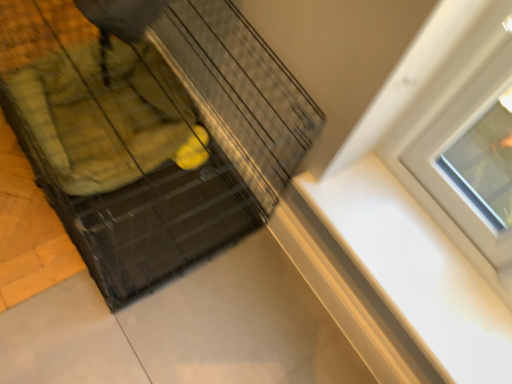
Question: From a real-world perspective, is white glossy window sill at upper right physically above black wire baby carriage at center?

Choices:
 (A) no
 (B) yes

Answer: (B)

Question: Is white glossy window sill at upper right turned away from black wire baby carriage at center?

Choices:
 (A) yes
 (B) no

Answer: (B)

Question: From the image's perspective, is white glossy window sill at upper right under black wire baby carriage at center?

Choices:
 (A) no
 (B) yes

Answer: (B)

Question: Considering the relative sizes of white glossy window sill at upper right and black wire baby carriage at center in the image provided, is white glossy window sill at upper right smaller than black wire baby carriage at center?

Choices:
 (A) yes
 (B) no

Answer: (A)

Question: Is white glossy window sill at upper right not within black wire baby carriage at center?

Choices:
 (A) no
 (B) yes

Answer: (B)

Question: Considering the relative sizes of white glossy window sill at upper right and black wire baby carriage at center in the image provided, is white glossy window sill at upper right wider than black wire baby carriage at center?

Choices:
 (A) yes
 (B) no

Answer: (B)

Question: Is black wire baby carriage at center oriented towards white glossy window sill at upper right?

Choices:
 (A) yes
 (B) no

Answer: (B)

Question: Is black wire baby carriage at center behind white glossy window sill at upper right?

Choices:
 (A) yes
 (B) no

Answer: (B)

Question: From the image's perspective, does black wire baby carriage at center appear lower than white glossy window sill at upper right?

Choices:
 (A) yes
 (B) no

Answer: (B)

Question: Does black wire baby carriage at center have a larger size compared to white glossy window sill at upper right?

Choices:
 (A) no
 (B) yes

Answer: (B)

Question: From a real-world perspective, does black wire baby carriage at center stand above white glossy window sill at upper right?

Choices:
 (A) yes
 (B) no

Answer: (B)

Question: Considering the relative sizes of black wire baby carriage at center and white glossy window sill at upper right in the image provided, is black wire baby carriage at center smaller than white glossy window sill at upper right?

Choices:
 (A) yes
 (B) no

Answer: (B)

Question: In the image, is white glossy window sill at upper right positioned in front of or behind black wire baby carriage at center?

Choices:
 (A) front
 (B) behind

Answer: (B)